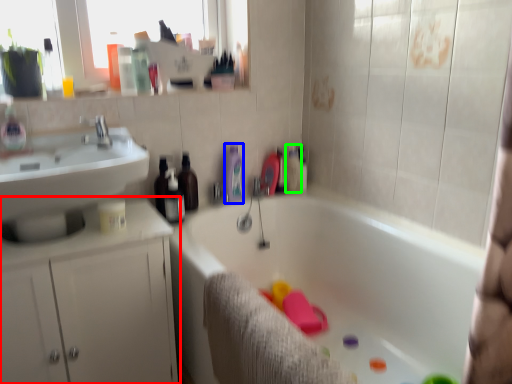
Question: Which object is positioned closest to bathroom cabinet (highlighted by a red box)? Select from toiletry (highlighted by a blue box) and toiletry (highlighted by a green box).

Choices:
 (A) toiletry
 (B) toiletry

Answer: (A)